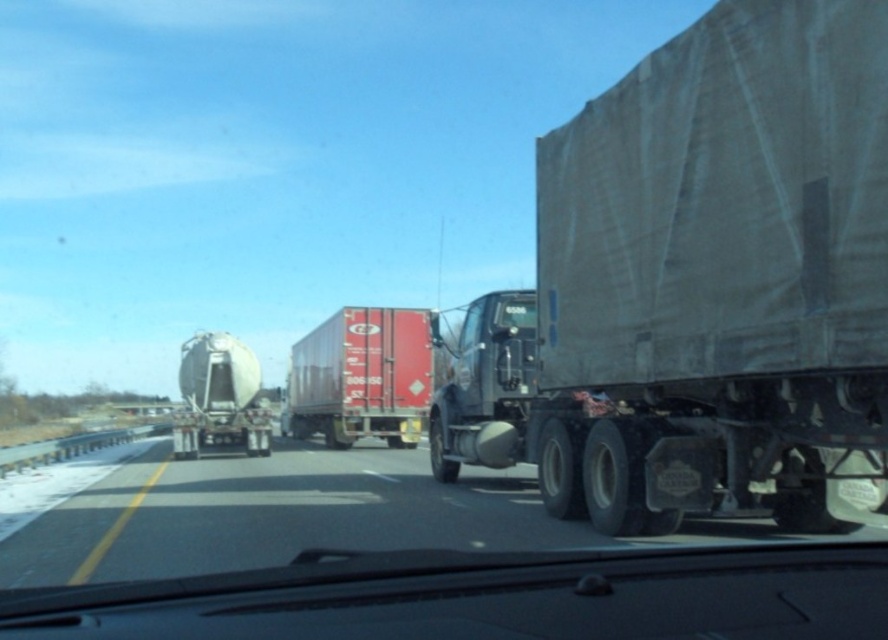
Looking at this image, you are a passenger in the vehicle and want to know which of the two points, point (284, 397) or point (189, 420), is closer to you. Based on the scene, which point is nearer?

Point (284, 397) is closer to you because it is further to the viewer than point (189, 420).

Looking at this image, you are driving a car and want to pass the gray tarpaulin trailer at right and the red matte container at center. Based on their heights, which one would block your view more when driving behind them?

The gray tarpaulin trailer at right has a greater height compared to the red matte container at center, so it would block your view more when driving behind them.